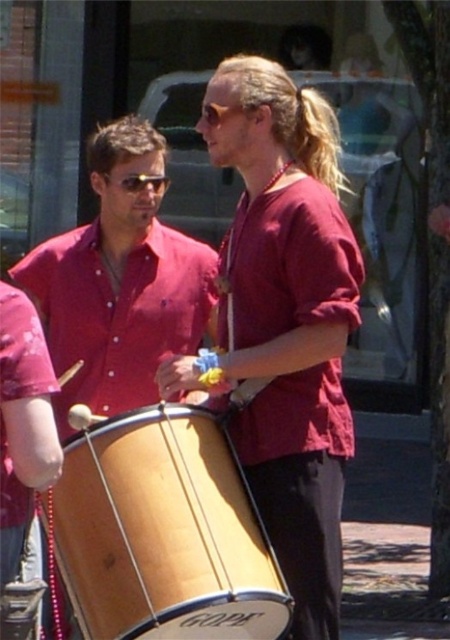
You are a photographer trying to capture a clear shot of both the matte red shirt at center and the wooden drum at center. However, you notice that one object is blocking the view of the other. Which object is obstructing the other?

The matte red shirt at center is positioned over the wooden drum at center, so it is obstructing the view of the wooden drum at center.

You are standing in the middle of the street and see two points marked on the ground. The first point is at coordinates point (72, 560) and the second point is at point (165, 177). Which point is closer to you?

Point (72, 560) is in front of point (165, 177), so it is closer to you.

Based on the coordinates provided in the scene description, where is the wooden drum at center located?

The wooden drum at center is located at point (162, 532).